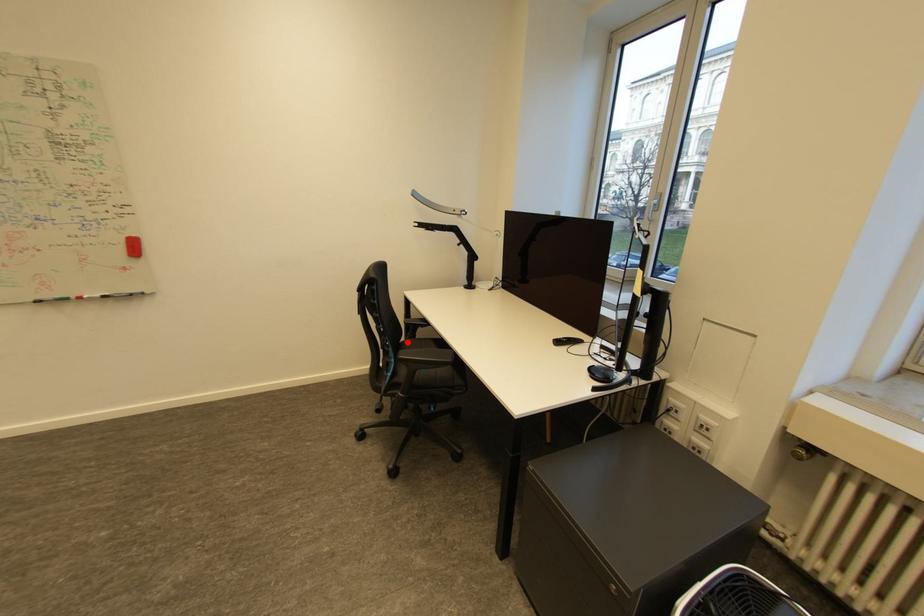
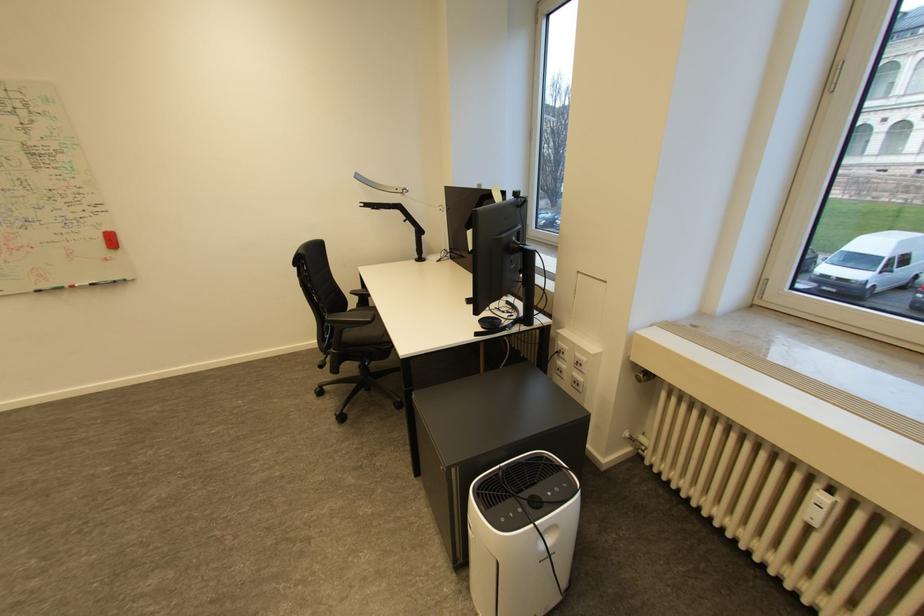
The point at the highlighted location is marked in the first image. Where is the corresponding point in the second image?

(355, 310)